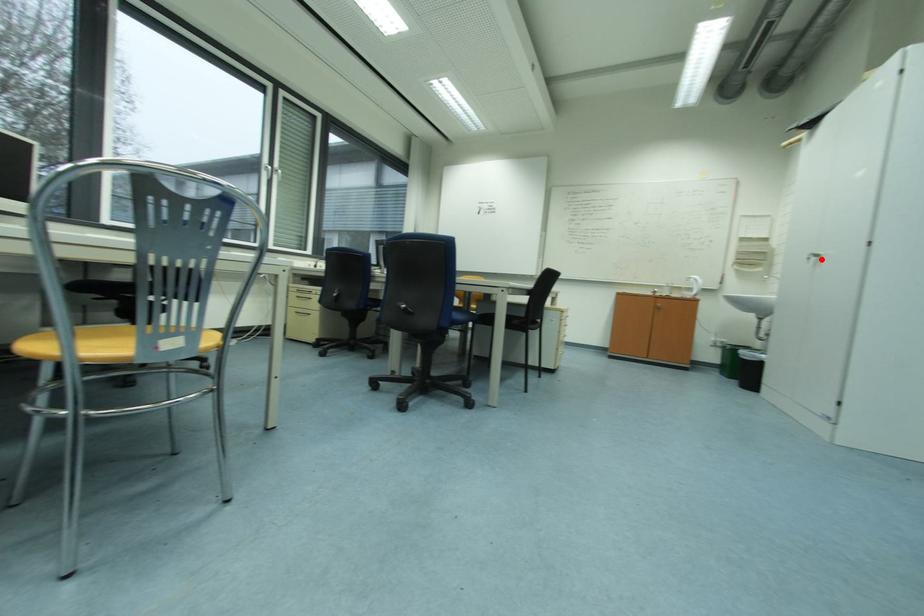
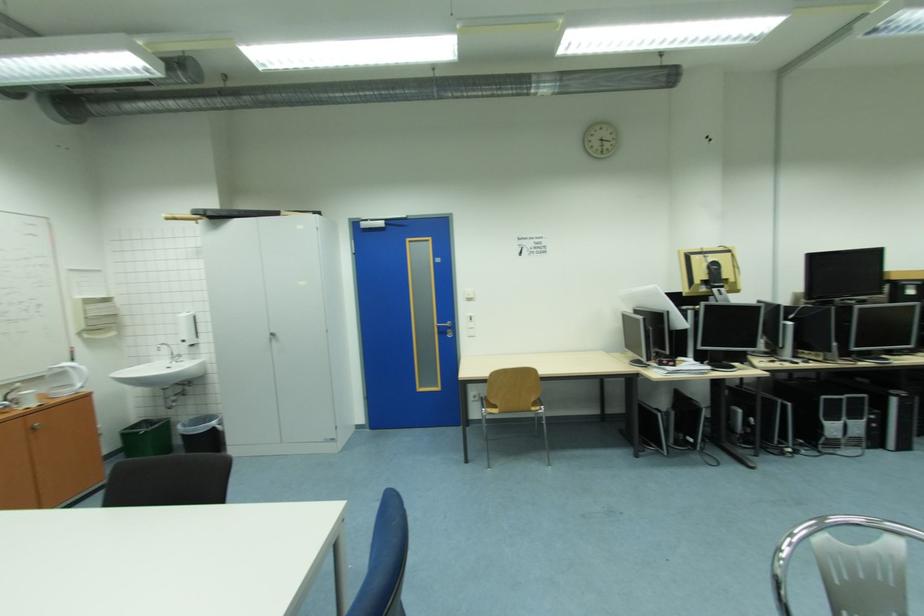
Where in the second image is the point corresponding to the highlighted location from the first image?

(278, 338)